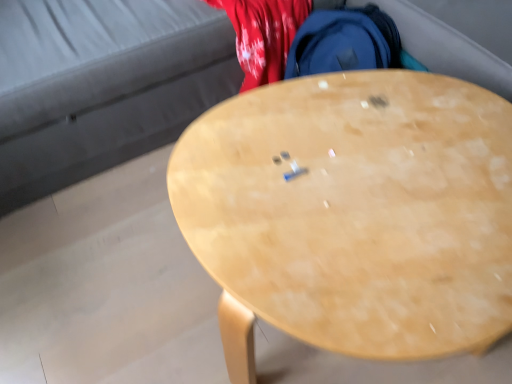
The height and width of the screenshot is (384, 512). What are the coordinates of `vacant space situated above light wood desk at center (from a real-world perspective)` in the screenshot? It's located at (361, 177).